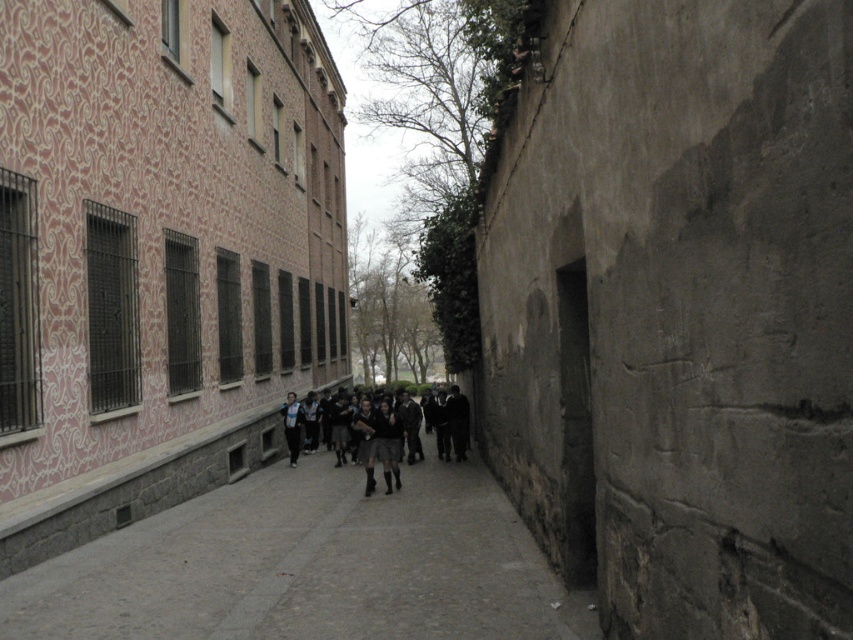
You are standing in the alleyway between the pinkish building with white patterns and the gray stone wall. You need to place a small potted plant exactly at the point marked as point (306, 566). According to the image, what surface will the potted plant be placed on?

The potted plant will be placed on the gray concrete pavement at center, as point (306, 566) corresponds to that surface.

You are standing in the alleyway and want to determine which of the two points, point (224, 605) or point (373, 420), is nearer to you. Based on the scene, which point is closer?

Point (224, 605) is closer to the viewer than point (373, 420).